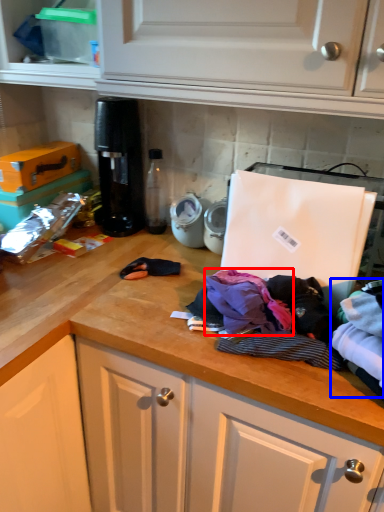
Question: Which point is closer to the camera, clothing (highlighted by a red box) or clothing (highlighted by a blue box)?

Choices:
 (A) clothing
 (B) clothing

Answer: (B)